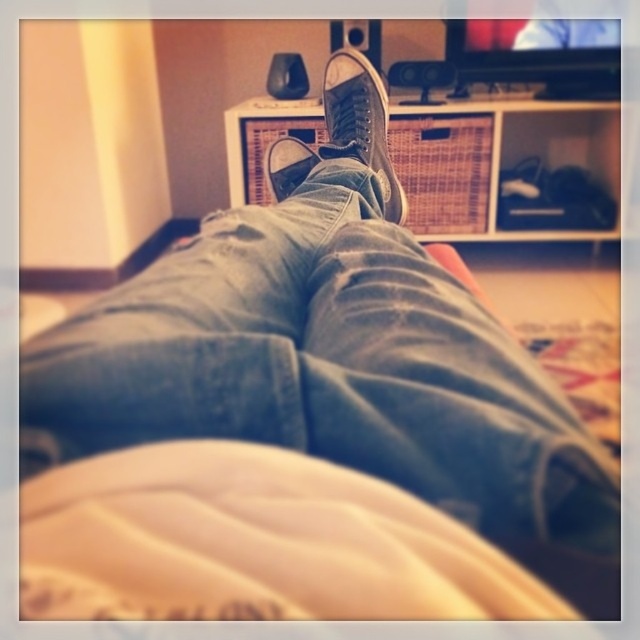
Question: Can you confirm if woven wood cabinet at upper center is positioned above matte black sneaker at center?

Choices:
 (A) no
 (B) yes

Answer: (B)

Question: Which point is closer to the camera?

Choices:
 (A) matte black sneaker at center
 (B) woven wood cabinet at upper center
 (C) matte black shoe at center

Answer: (A)

Question: Is woven wood cabinet at upper center behind matte black sneaker at center?

Choices:
 (A) yes
 (B) no

Answer: (A)

Question: Which of these objects is positioned farthest from the matte black shoe at center?

Choices:
 (A) woven wood cabinet at upper center
 (B) matte black sneaker at center

Answer: (A)

Question: Does woven wood cabinet at upper center have a greater width compared to matte black shoe at center?

Choices:
 (A) yes
 (B) no

Answer: (A)

Question: Which object is farther from the camera taking this photo?

Choices:
 (A) woven wood cabinet at upper center
 (B) matte black shoe at center

Answer: (A)